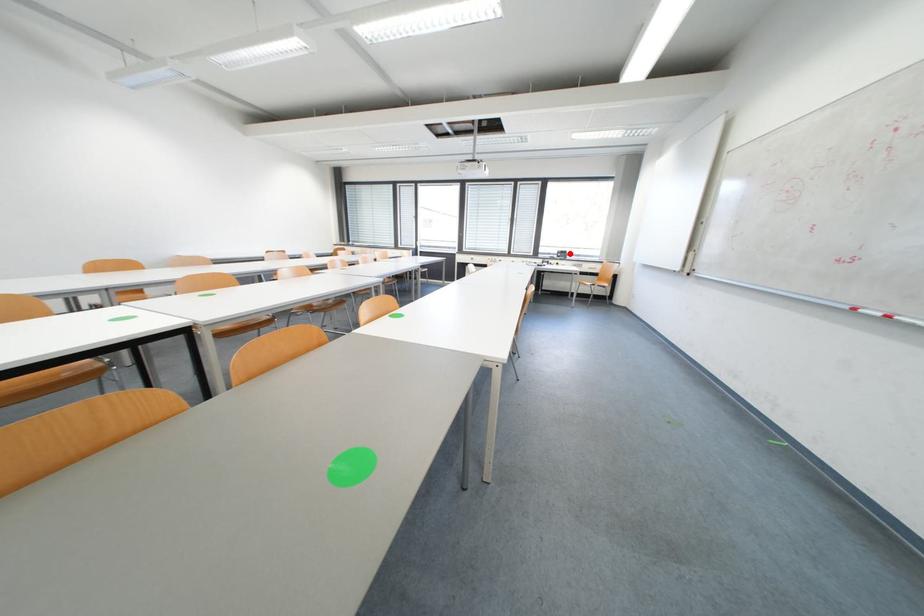
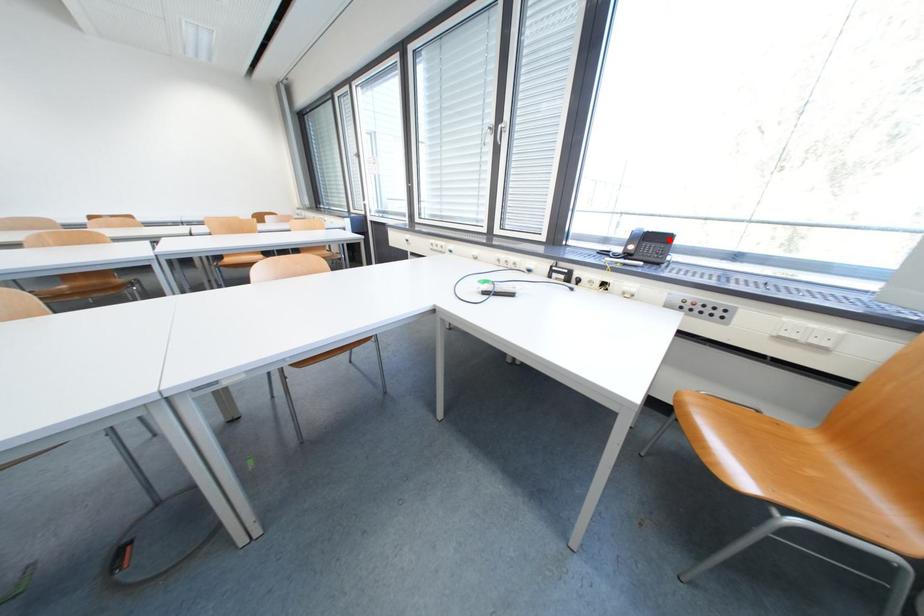
I am providing you with two images of the same scene from different viewpoints. A red point is marked on the first image and another point is marked on the second image. Are the points marked in image1 and image2 representing the same 3D position?

Yes